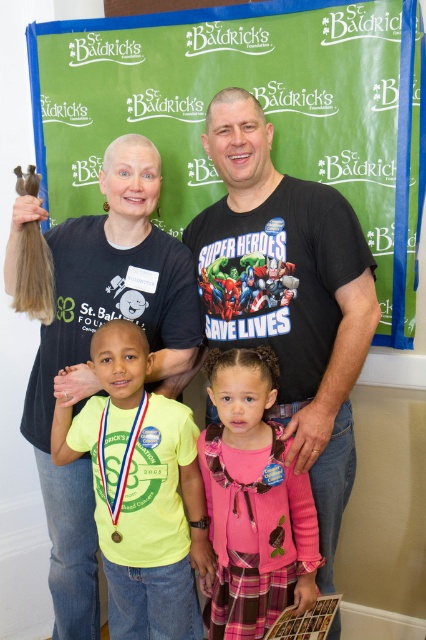
Based on the scene description, where is the wooden plaque at center located in the image?

The wooden plaque at center is located at point (259, 99).